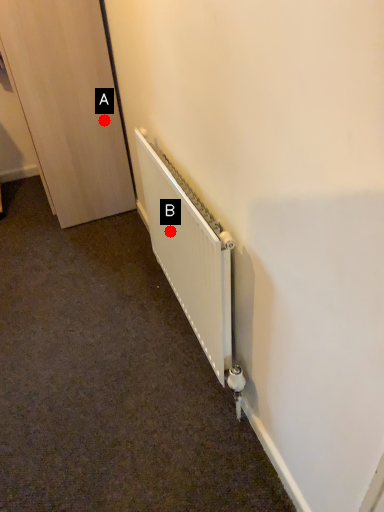
Question: Two points are circled on the image, labeled by A and B beside each circle. Which point is closer to the camera?

Choices:
 (A) A is closer
 (B) B is closer

Answer: (B)